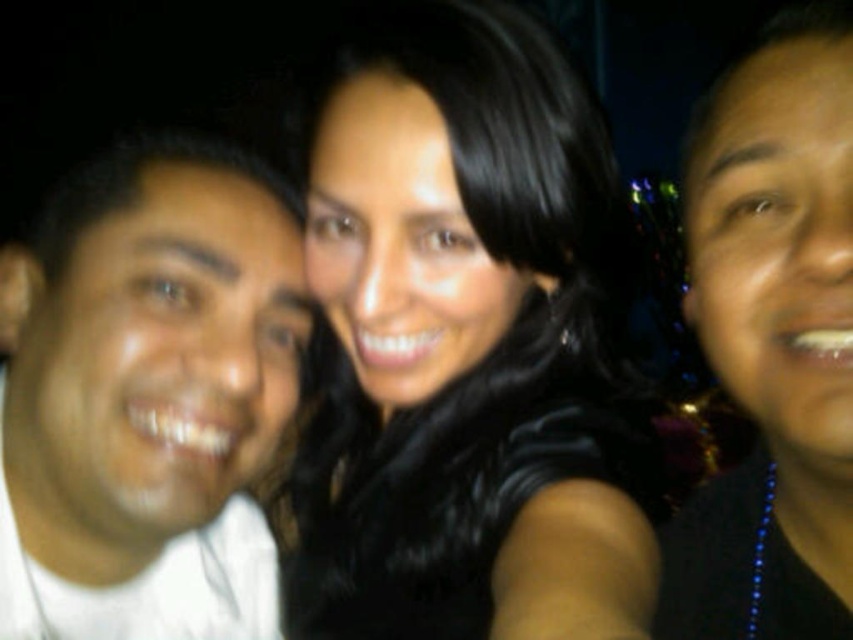
Looking at this image, you are a photographer adjusting the lighting for a night portrait. You notice the white matte shirt at left and the black matte necklace at center in the frame. Which object is positioned lower in the image?

The white matte shirt at left is located below the black matte necklace at center, so it is positioned lower in the image.

You are taking a photo of the group selfie scene. You notice two points marked as point 1 at coordinates [430,209] and point 2 at coordinates [718,141]. Which point is closer to the camera?

Point 2 at coordinates [718,141] is closer to the camera because point 1 at coordinates [430,209] is behind it.